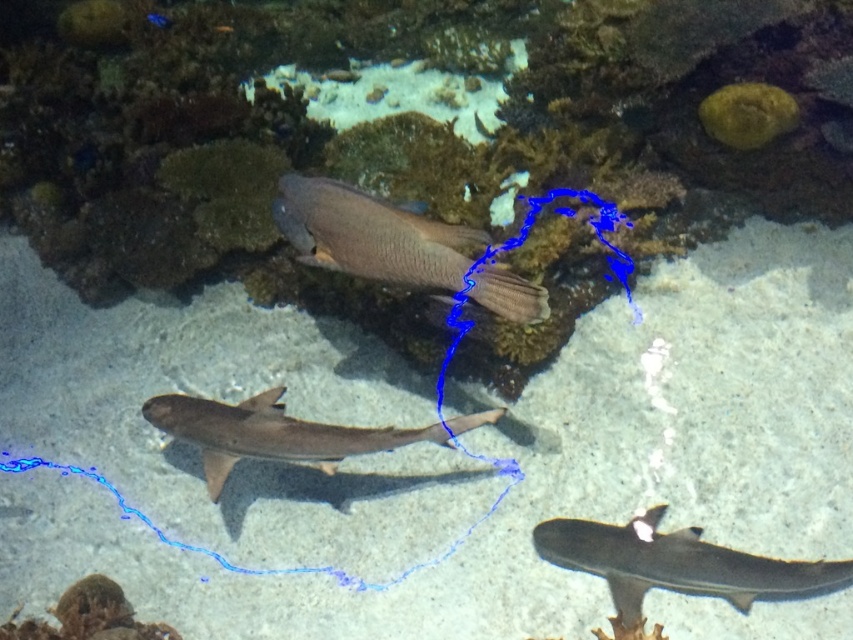
Is matte brown fish at center smaller than smooth gray shark at center?

Actually, matte brown fish at center might be larger than smooth gray shark at center.

How far apart are matte brown fish at center and smooth gray shark at center?

A distance of 12.28 inches exists between matte brown fish at center and smooth gray shark at center.

Is point (337, 227) farther from camera compared to point (265, 456)?

No, it is in front of (265, 456).

Where is `matte brown fish at center`? The width and height of the screenshot is (853, 640). matte brown fish at center is located at coordinates (395, 244).

Which of these two, smooth gray shark at lower right or smooth gray shark at center, stands shorter?

smooth gray shark at lower right is shorter.

In the scene shown: Is smooth gray shark at lower right positioned before smooth gray shark at center?

Yes.

Where is `smooth gray shark at lower right`? This screenshot has width=853, height=640. smooth gray shark at lower right is located at coordinates (675, 563).

Looking at this image, which is more to the left, matte brown fish at center or smooth gray shark at lower right?

matte brown fish at center

Is matte brown fish at center shorter than smooth gray shark at lower right?

No.

Which is behind, point (509, 312) or point (553, 563)?

Point (553, 563)

Identify the location of matte brown fish at center. (395, 244).